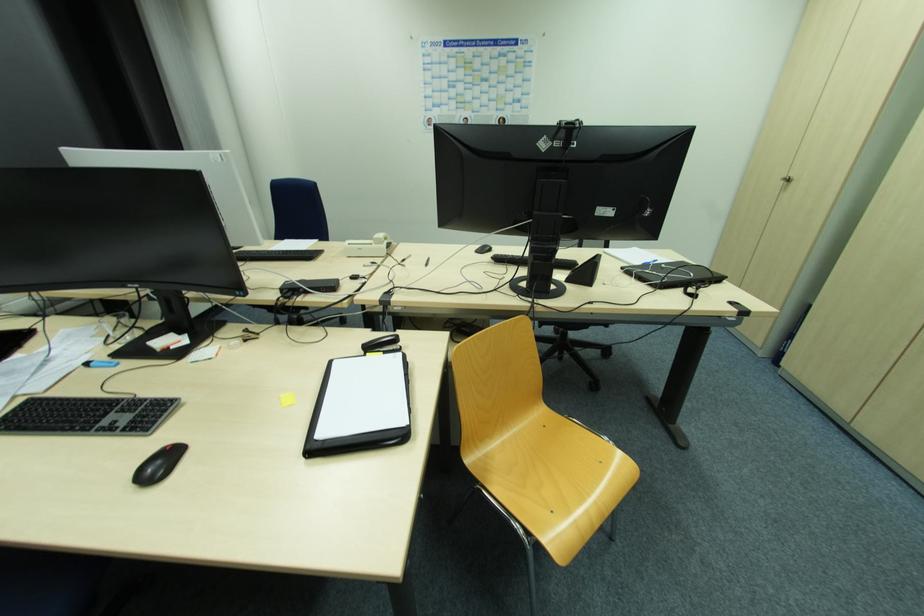
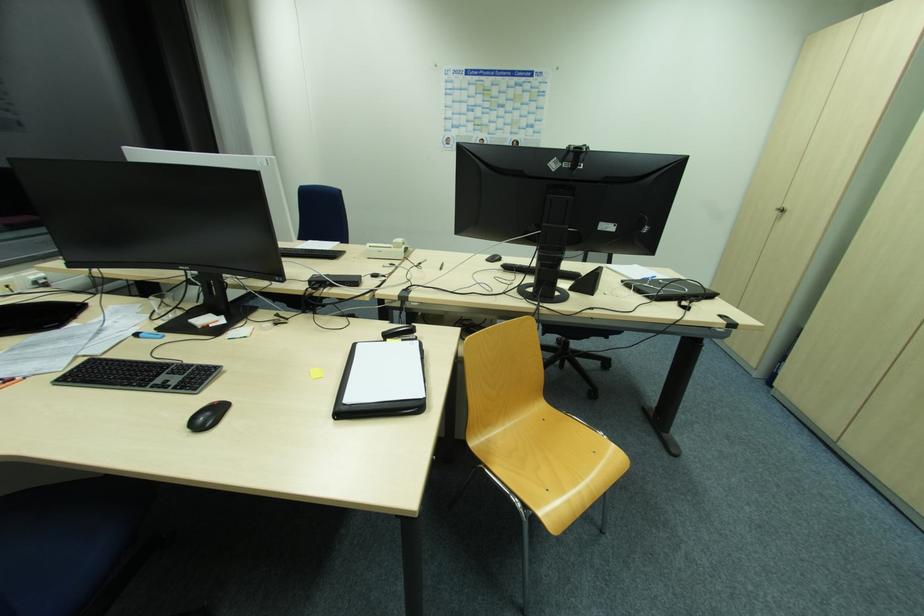
The point at (546, 427) is marked in the first image. Where is the corresponding point in the second image?

(545, 421)